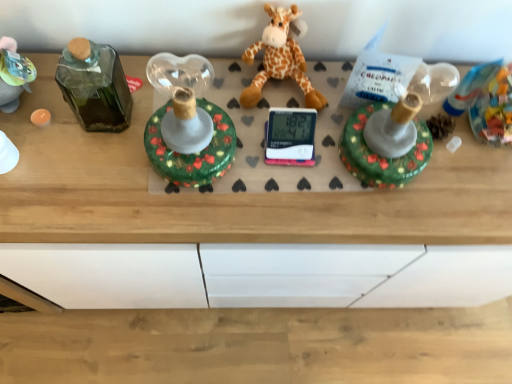
At what (x,y) coordinates should I click in order to perform the action: click on vacant space underneath soft plush giraffe at center (from a real-world perspective). Please return your answer as a coordinate pair (x, y). The height and width of the screenshot is (384, 512). Looking at the image, I should click on (279, 88).